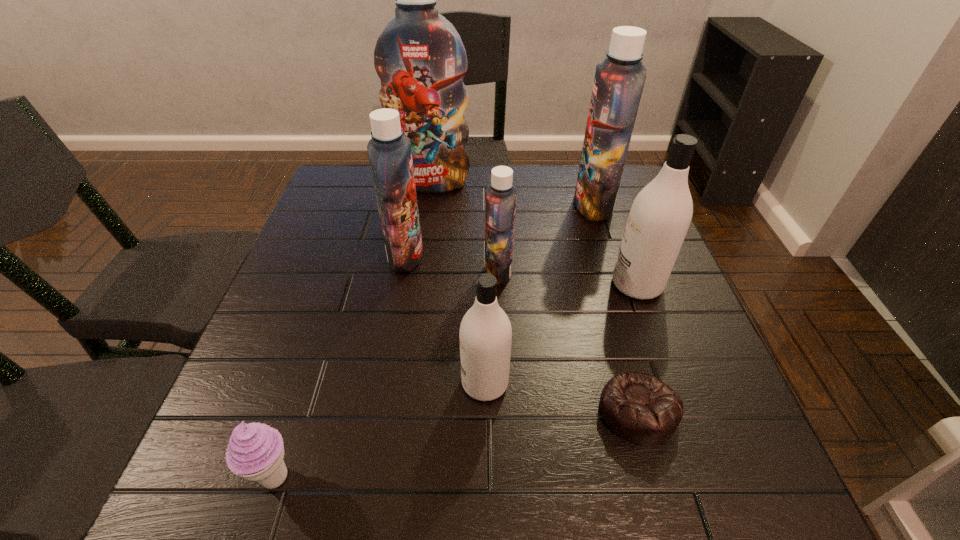
The width and height of the screenshot is (960, 540). What are the coordinates of `free space that is in between the left white shampoo and the bigger white shampoo` in the screenshot? It's located at (561, 334).

Find the location of a particular element. The height and width of the screenshot is (540, 960). free space between the brown beanbag and the icecream is located at coordinates (457, 444).

The height and width of the screenshot is (540, 960). I want to click on empty location between the second blue shampoo from right to left and the purple icecream, so click(387, 374).

You are a GUI agent. You are given a task and a screenshot of the screen. Output one action in this format:
    pyautogui.click(x=<x>, y=<y>)
    Task: Click on the vacant space that is in between the tallest object and the smallest blue shampoo
    
    Given the screenshot: What is the action you would take?
    pyautogui.click(x=465, y=227)

I want to click on free space between the second tallest object and the second blue shampoo from right to left, so click(545, 238).

At what (x,y) coordinates should I click in order to perform the action: click on free space that is in between the beanbag and the purple icecream. Please return your answer as a coordinate pair (x, y). Looking at the image, I should click on (457, 444).

The height and width of the screenshot is (540, 960). Identify the location of vacant space in between the nearer white shampoo and the tallest shampoo. (458, 283).

Locate which object is the sixth closest to the icecream. Please provide its 2D coordinates. Your answer should be formatted as a tuple, i.e. [(x, y)], where the tuple contains the x and y coordinates of a point satisfying the conditions above.

[(420, 58)]

Find the location of a particular element. Image resolution: width=960 pixels, height=540 pixels. object that can be found as the fourth closest to the third biggest blue shampoo is located at coordinates (619, 81).

Image resolution: width=960 pixels, height=540 pixels. Identify the location of shampoo object that ranks as the fifth closest to the smallest blue shampoo. (420, 58).